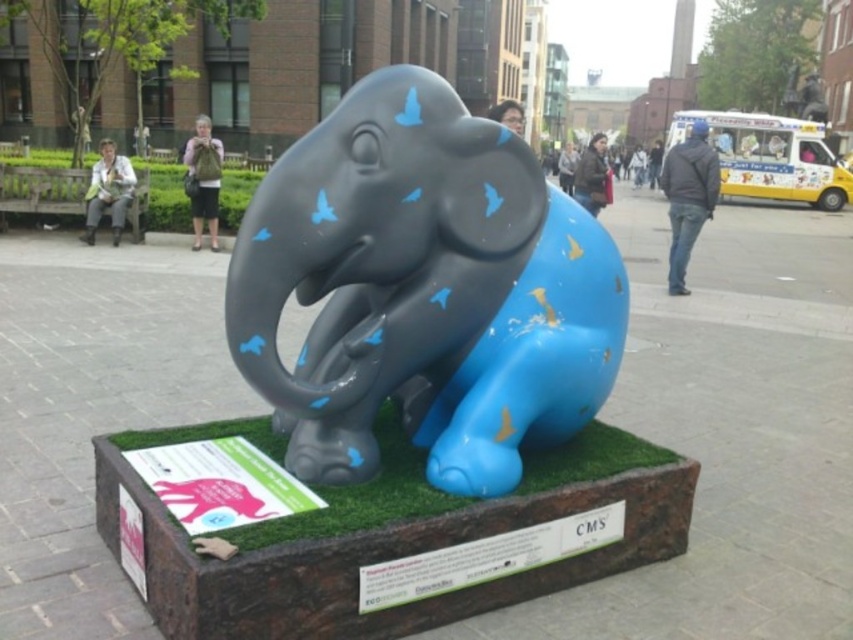
Question: Which object is positioned closest to the blue matte elephant at center?

Choices:
 (A) green artificial turf at center
 (B) matte black elephant at center

Answer: (B)

Question: Is blue matte elephant at center thinner than green artificial turf at center?

Choices:
 (A) yes
 (B) no

Answer: (A)

Question: Is the position of matte black elephant at center more distant than that of blue matte elephant at center?

Choices:
 (A) no
 (B) yes

Answer: (A)

Question: Considering the relative positions of matte black elephant at center and blue matte elephant at center in the image provided, where is matte black elephant at center located with respect to blue matte elephant at center?

Choices:
 (A) left
 (B) right

Answer: (A)

Question: Which object is closer to the camera taking this photo?

Choices:
 (A) green artificial turf at center
 (B) matte black elephant at center

Answer: (A)

Question: Among these points, which one is nearest to the camera?

Choices:
 (A) (403, 500)
 (B) (496, 376)
 (C) (479, 451)

Answer: (A)